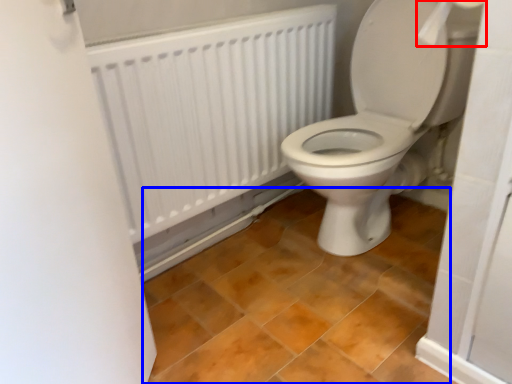
Question: Which point is further to the camera, toilet paper (highlighted by a red box) or ceramic tile (highlighted by a blue box)?

Choices:
 (A) toilet paper
 (B) ceramic tile

Answer: (A)